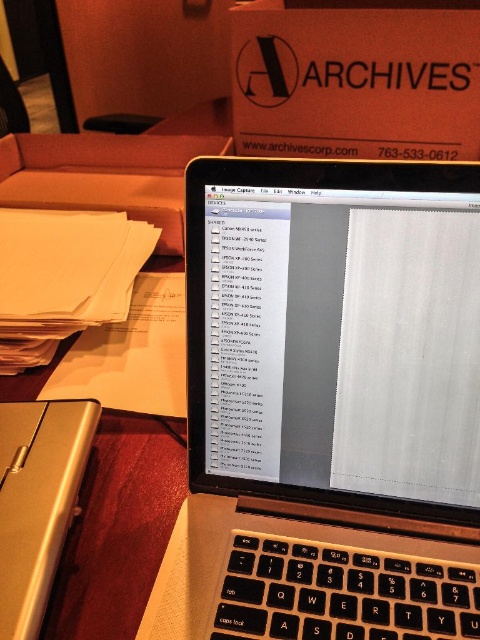
Question: Which point appears closest to the camera in this image?

Choices:
 (A) (400, 40)
 (B) (57, 408)
 (C) (412, 532)

Answer: (C)

Question: Is matte black cardboard box at upper center further to camera compared to silver metallic case at lower left?

Choices:
 (A) yes
 (B) no

Answer: (A)

Question: Among these objects, which one is nearest to the camera?

Choices:
 (A) matte black cardboard box at upper center
 (B) silver/black laptop at center
 (C) silver metallic case at lower left

Answer: (C)

Question: Is matte black cardboard box at upper center in front of silver metallic case at lower left?

Choices:
 (A) no
 (B) yes

Answer: (A)

Question: Is the position of matte black cardboard box at upper center more distant than that of silver metallic case at lower left?

Choices:
 (A) no
 (B) yes

Answer: (B)

Question: Which point is farther from the camera taking this photo?

Choices:
 (A) (274, 224)
 (B) (40, 579)
 (C) (368, 125)

Answer: (C)